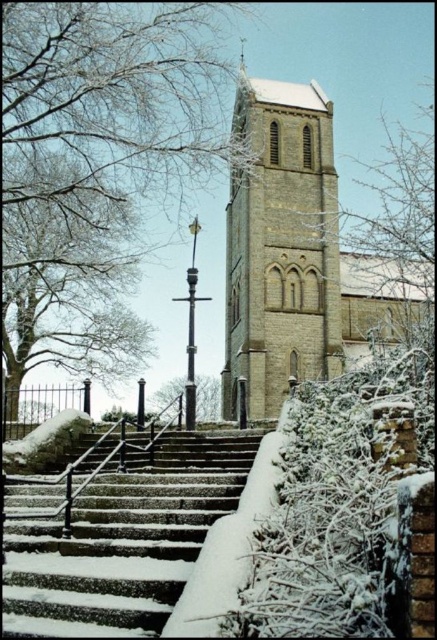
Who is more forward, (280, 269) or (138, 616)?

Point (138, 616) is in front.

The width and height of the screenshot is (437, 640). I want to click on beige stone church at center, so click(x=295, y=253).